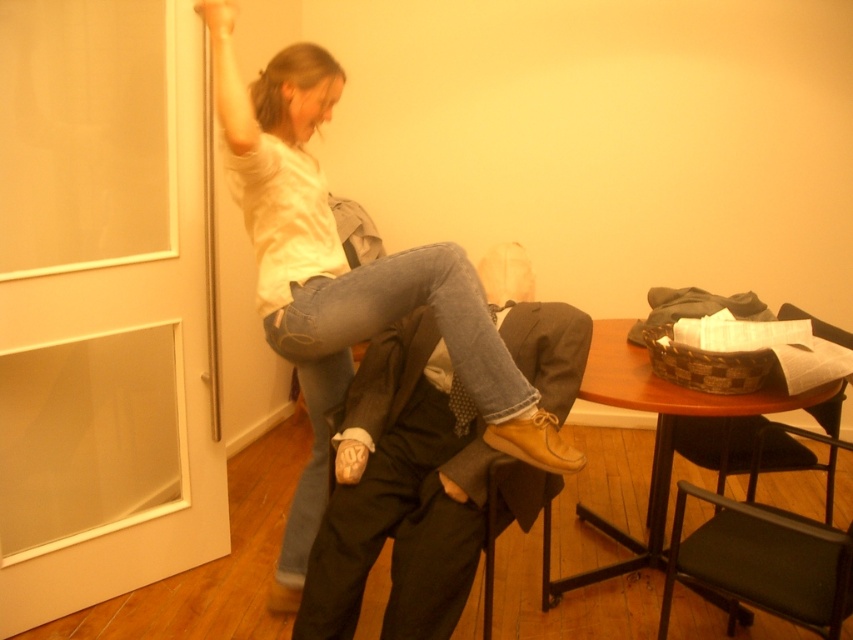
Question: Which point is closer to the camera?

Choices:
 (A) wooden table at center
 (B) denim jeans at center

Answer: (B)

Question: Which object is the farthest from the green fabric chair at lower right?

Choices:
 (A) dark brown fabric pants at center
 (B) wooden table at center
 (C) denim jeans at center

Answer: (C)

Question: Is denim jeans at center above green fabric chair at lower right?

Choices:
 (A) no
 (B) yes

Answer: (B)

Question: Which object is closer to the camera taking this photo?

Choices:
 (A) green fabric chair at lower right
 (B) denim jeans at center
 (C) wooden table at center

Answer: (A)

Question: Observing the image, what is the correct spatial positioning of denim jeans at center in reference to green fabric chair at lower right?

Choices:
 (A) right
 (B) left

Answer: (B)

Question: Does white translucent screen door at left appear under wooden table at center?

Choices:
 (A) no
 (B) yes

Answer: (A)